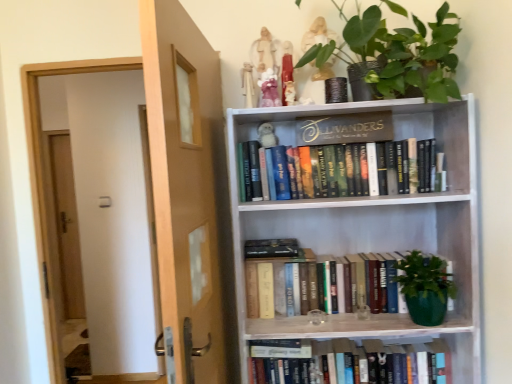
Where is `blank space above hardcover books at center, acting as the second book starting from the top (from a real-world perspective)`? Image resolution: width=512 pixels, height=384 pixels. blank space above hardcover books at center, acting as the second book starting from the top (from a real-world perspective) is located at coordinates (343, 259).